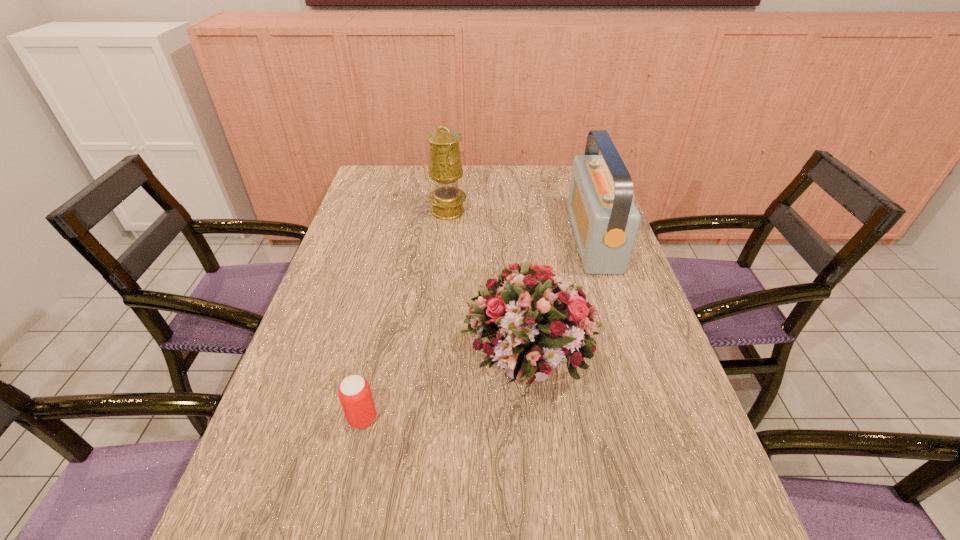
The image size is (960, 540). In order to click on free location located 0.070m on the left of the shortest object in this screenshot , I will do `click(314, 418)`.

At what (x,y) coordinates should I click in order to perform the action: click on object that is positioned at the right edge. Please return your answer as a coordinate pair (x, y). Looking at the image, I should click on (605, 220).

In the image, there is a desktop. Identify the location of vacant space at the left edge. (274, 417).

Identify the location of free space at the right edge of the desktop. (631, 280).

Identify the location of vacant space at the far right corner of the desktop. (562, 197).

Where is `empty space between the bouquet and the beer can`? empty space between the bouquet and the beer can is located at coordinates (445, 395).

Where is `free space between the shortest object and the oil lamp`? free space between the shortest object and the oil lamp is located at coordinates (405, 315).

Image resolution: width=960 pixels, height=540 pixels. In order to click on vacant area that lies between the leftmost object and the second object from right to left in this screenshot , I will do `click(445, 395)`.

The width and height of the screenshot is (960, 540). Identify the location of the closest object to the oil lamp. (605, 220).

Select which object is the third closest to the beer can. Please provide its 2D coordinates. Your answer should be formatted as a tuple, i.e. [(x, y)], where the tuple contains the x and y coordinates of a point satisfying the conditions above.

[(445, 168)]